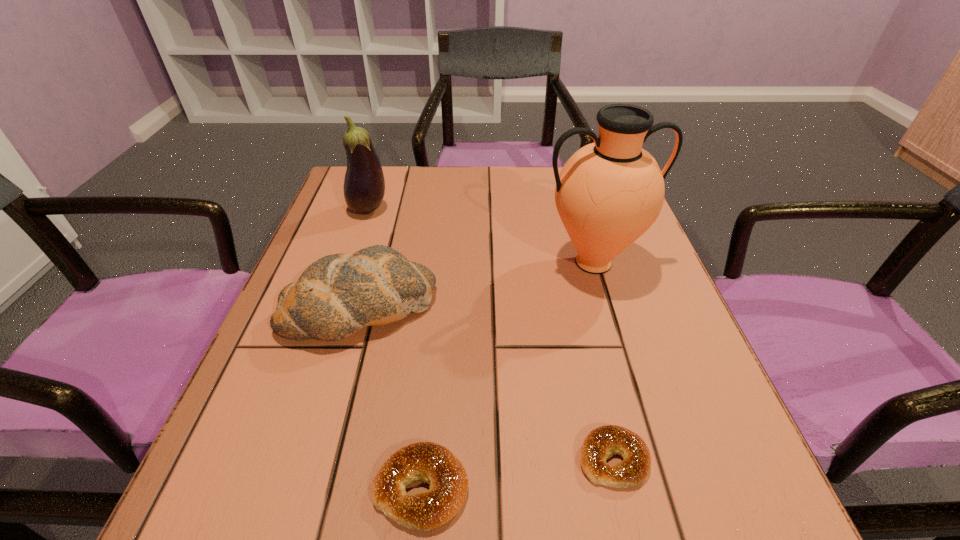
You are a GUI agent. You are given a task and a screenshot of the screen. Output one action in this format:
    pyautogui.click(x=<x>, y=<y>)
    Task: Click on the pitcher
    This screenshot has width=960, height=540.
    Given the screenshot: What is the action you would take?
    pyautogui.click(x=610, y=192)

The image size is (960, 540). In order to click on eggplant in this screenshot , I will do `click(364, 185)`.

Identify the location of the second tallest object. (x=364, y=185).

You are a GUI agent. You are given a task and a screenshot of the screen. Output one action in this format:
    pyautogui.click(x=<x>, y=<y>)
    Task: Click on the third shortest object
    The height and width of the screenshot is (540, 960).
    Given the screenshot: What is the action you would take?
    pyautogui.click(x=336, y=296)

In order to click on the fourth tallest object in this screenshot , I will do `click(431, 463)`.

The image size is (960, 540). In order to click on the left bagel in this screenshot , I will do `click(431, 463)`.

This screenshot has height=540, width=960. Find the location of `the shorter bagel`. the shorter bagel is located at coordinates 600,443.

Image resolution: width=960 pixels, height=540 pixels. I want to click on the right bagel, so click(600, 443).

Identify the location of free space located on the left of the pitcher. The image size is (960, 540). (387, 262).

The width and height of the screenshot is (960, 540). In order to click on blank area located on the back of the eggplant in this screenshot , I will do `click(377, 184)`.